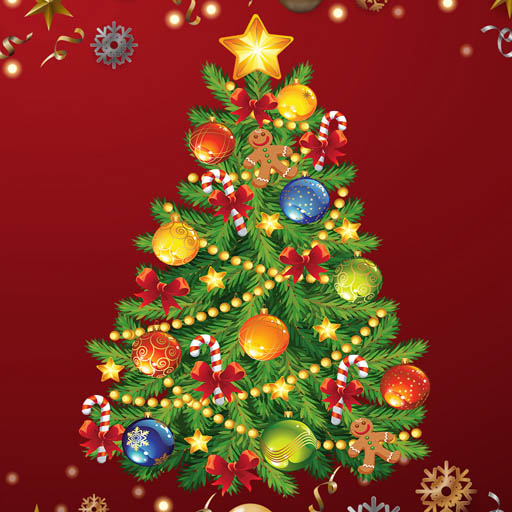
Image resolution: width=512 pixels, height=512 pixels. I want to click on red ornament, so click(158, 360).